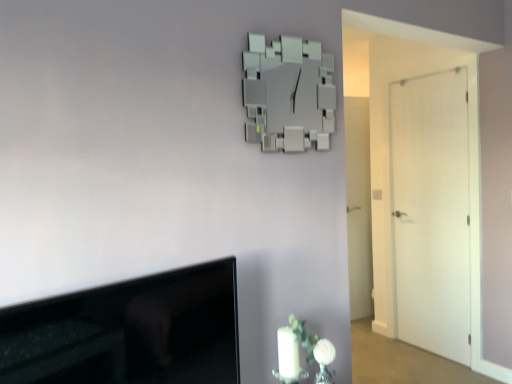
This screenshot has width=512, height=384. I want to click on white matte clock at upper center, so click(x=288, y=94).

Where is `white matte clock at upper center`? white matte clock at upper center is located at coordinates pos(288,94).

From the image's perspective, is white matte vase at lower right on white matte door at right, the 2th door positioned from the back?

No.

In the scene shown: Considering the relative sizes of white matte vase at lower right and white matte door at right, which is the first door in right-to-left order, in the image provided, is white matte vase at lower right shorter than white matte door at right, which is the first door in right-to-left order,?

Indeed, white matte vase at lower right has a lesser height compared to white matte door at right, which is the first door in right-to-left order.

Does white matte vase at lower right turn towards white matte door at right, the second door when ordered from left to right?

No.

Who is taller, white matte door at right, the second door when ordered from left to right, or white matte clock at upper center?

With more height is white matte door at right, the second door when ordered from left to right.

From a real-world perspective, is white matte door at right, which is the first door in right-to-left order, positioned above or below white matte clock at upper center?

From a real-world perspective, white matte door at right, which is the first door in right-to-left order, is physically below white matte clock at upper center.

Is white matte door at right, the 2th door positioned from the back, surrounding white matte clock at upper center?

Definitely not — white matte clock at upper center is not inside white matte door at right, the 2th door positioned from the back.

Relative to white matte clock at upper center, is white matte door at right, which is the first door in right-to-left order, in front or behind?

white matte door at right, which is the first door in right-to-left order, is positioned farther from the viewer than white matte clock at upper center.

Is white matte clock at upper center not within white matte door at right, which ranks as the second door in front-to-back order?

white matte clock at upper center lies outside white matte door at right, which ranks as the second door in front-to-back order,'s area.

Would you say white matte clock at upper center is a long distance from white matte door at right, arranged as the 2th door when viewed from the right?

No, white matte clock at upper center is not far away from white matte door at right, arranged as the 2th door when viewed from the right.

Is white matte clock at upper center looking in the opposite direction of white matte door at right, arranged as the 2th door when viewed from the right?

No, white matte door at right, arranged as the 2th door when viewed from the right, is not at the back of white matte clock at upper center.

Considering the relative positions of white matte clock at upper center and white matte door at right, which ranks as the second door in front-to-back order, in the image provided, is white matte clock at upper center to the right of white matte door at right, which ranks as the second door in front-to-back order, from the viewer's perspective?

Incorrect, white matte clock at upper center is not on the right side of white matte door at right, which ranks as the second door in front-to-back order.

Identify the location of door that is the 1st one when counting rightward from the white matte vase at lower right. The height and width of the screenshot is (384, 512). (358, 206).

Who is shorter, white matte vase at lower right or white matte door at right, which ranks as the second door in front-to-back order?

white matte vase at lower right is shorter.

Does white matte vase at lower right have a greater width compared to white matte door at right, which ranks as the 1th door in left-to-right order?

Correct, the width of white matte vase at lower right exceeds that of white matte door at right, which ranks as the 1th door in left-to-right order.

Can you confirm if white matte vase at lower right is smaller than white matte door at right, arranged as the 2th door when viewed from the right?

Correct, white matte vase at lower right occupies less space than white matte door at right, arranged as the 2th door when viewed from the right.

Is white matte clock at upper center located outside white matte door at right, the 2th door positioned from the back?

Yes.

Which point is more distant from viewer, (x=252, y=137) or (x=415, y=199)?

Point (x=415, y=199)

Is white matte clock at upper center taller than white matte door at right, the 2th door positioned from the back?

No, white matte clock at upper center is not taller than white matte door at right, the 2th door positioned from the back.

Is white matte clock at upper center positioned with its back to white matte door at right, the second door when ordered from left to right?

No, white matte clock at upper center is not facing away from white matte door at right, the second door when ordered from left to right.

From the image's perspective, which is below, white matte door at right, arranged as the 2th door when viewed from the right, or white matte clock at upper center?

white matte door at right, arranged as the 2th door when viewed from the right, is shown below in the image.

Looking at this image, considering the relative positions of white matte door at right, arranged as the 2th door when viewed from the right, and white matte clock at upper center in the image provided, is white matte door at right, arranged as the 2th door when viewed from the right, to the left of white matte clock at upper center from the viewer's perspective?

No.

Does white matte door at right, which ranks as the second door in front-to-back order, lie behind white matte clock at upper center?

Yes, it is.

In the image, is black glossy tv at lower left on the left side or the right side of white matte door at right, the 1th door from the back?

Clearly, black glossy tv at lower left is on the left of white matte door at right, the 1th door from the back, in the image.

Considering the relative sizes of black glossy tv at lower left and white matte door at right, arranged as the 2th door when viewed from the right, in the image provided, is black glossy tv at lower left smaller than white matte door at right, arranged as the 2th door when viewed from the right,?

Actually, black glossy tv at lower left might be larger than white matte door at right, arranged as the 2th door when viewed from the right.

Image resolution: width=512 pixels, height=384 pixels. In order to click on television that is in front of the white matte door at right, which ranks as the 1th door in left-to-right order in this screenshot , I will do `click(128, 332)`.

Image resolution: width=512 pixels, height=384 pixels. Find the location of `floral arrangement below the white matte door at right, which appears as the first door when viewed from the front (from the image's perspective)`. floral arrangement below the white matte door at right, which appears as the first door when viewed from the front (from the image's perspective) is located at coordinates (309, 348).

Find the location of a particular element. The height and width of the screenshot is (384, 512). door that is the 1st one when counting backward from the white matte clock at upper center is located at coordinates (431, 212).

Looking at the image, which one is located closer to white matte door at right, arranged as the 2th door when viewed from the right, white matte vase at lower right or white matte door at right, the 2th door positioned from the back?

white matte door at right, the 2th door positioned from the back, is closer to white matte door at right, arranged as the 2th door when viewed from the right.

From the image, which object appears to be nearer to white matte door at right, arranged as the 2th door when viewed from the right, white matte door at right, the second door when ordered from left to right, or white matte vase at lower right?

Among the two, white matte door at right, the second door when ordered from left to right, is located nearer to white matte door at right, arranged as the 2th door when viewed from the right.

Based on their spatial positions, is white matte door at right, which ranks as the 1th door in left-to-right order, or white matte clock at upper center further from black glossy tv at lower left?

white matte door at right, which ranks as the 1th door in left-to-right order, is positioned further to the anchor black glossy tv at lower left.

Estimate the real-world distances between objects in this image. Which object is further from white matte door at right, which ranks as the 1th door in left-to-right order, black glossy tv at lower left or white matte clock at upper center?

black glossy tv at lower left.

Based on their spatial positions, is white matte clock at upper center or white matte vase at lower right closer to black glossy tv at lower left?

Among the two, white matte vase at lower right is located nearer to black glossy tv at lower left.

Looking at this image, from the image, which object appears to be farther from black glossy tv at lower left, white matte door at right, which appears as the first door when viewed from the front, or white matte vase at lower right?

white matte door at right, which appears as the first door when viewed from the front.

When comparing their distances from white matte clock at upper center, does black glossy tv at lower left or white matte vase at lower right seem further?

Based on the image, black glossy tv at lower left appears to be further to white matte clock at upper center.

Which object lies nearer to the anchor point white matte door at right, the 2th door positioned from the back, white matte clock at upper center or white matte door at right, arranged as the 2th door when viewed from the right?

The object closer to white matte door at right, the 2th door positioned from the back, is white matte door at right, arranged as the 2th door when viewed from the right.

Find the location of a particular element. This screenshot has width=512, height=384. mirror between white matte vase at lower right and white matte door at right, which ranks as the 1th door in left-to-right order, from front to back is located at coordinates (288, 94).

The image size is (512, 384). Identify the location of mirror between black glossy tv at lower left and white matte door at right, which ranks as the 1th door in left-to-right order, from front to back. (288, 94).

At what (x,y) coordinates should I click in order to perform the action: click on floral arrangement between black glossy tv at lower left and white matte door at right, the 1th door from the back, in the front-back direction. Please return your answer as a coordinate pair (x, y). The image size is (512, 384). Looking at the image, I should click on (309, 348).

Image resolution: width=512 pixels, height=384 pixels. I want to click on door between white matte vase at lower right and white matte door at right, arranged as the 2th door when viewed from the right, from front to back, so click(431, 212).